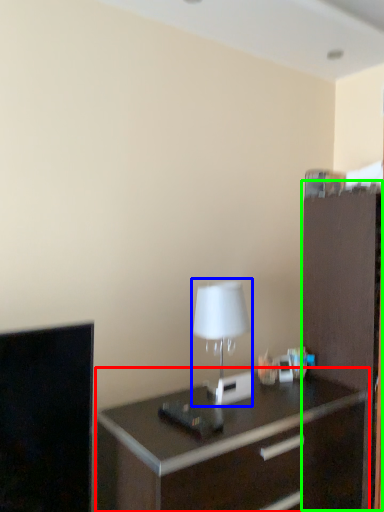
Question: Based on their relative distances, which object is nearer to chest of drawers (highlighted by a red box)? Choose from table lamp (highlighted by a blue box) and file cabinet (highlighted by a green box).

Choices:
 (A) table lamp
 (B) file cabinet

Answer: (B)